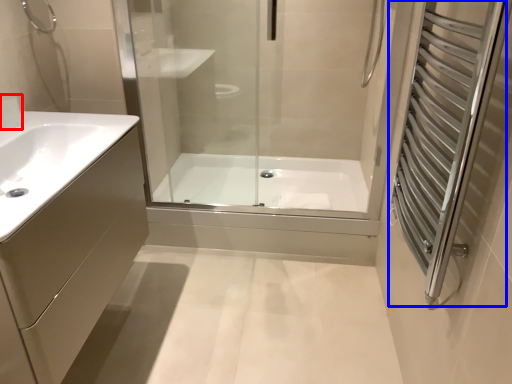
Question: Which of the following is the farthest to the observer, faucet (highlighted by a red box) or screen door (highlighted by a blue box)?

Choices:
 (A) faucet
 (B) screen door

Answer: (A)